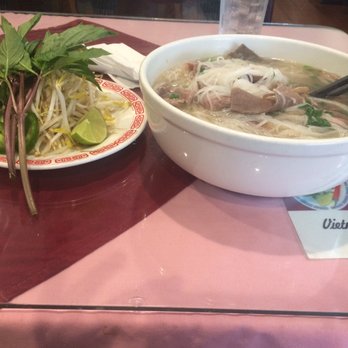
At what (x,y) coordinates should I click in order to perform the action: click on glass table. Please return your answer as a coordinate pair (x, y). Looking at the image, I should click on (131, 229).